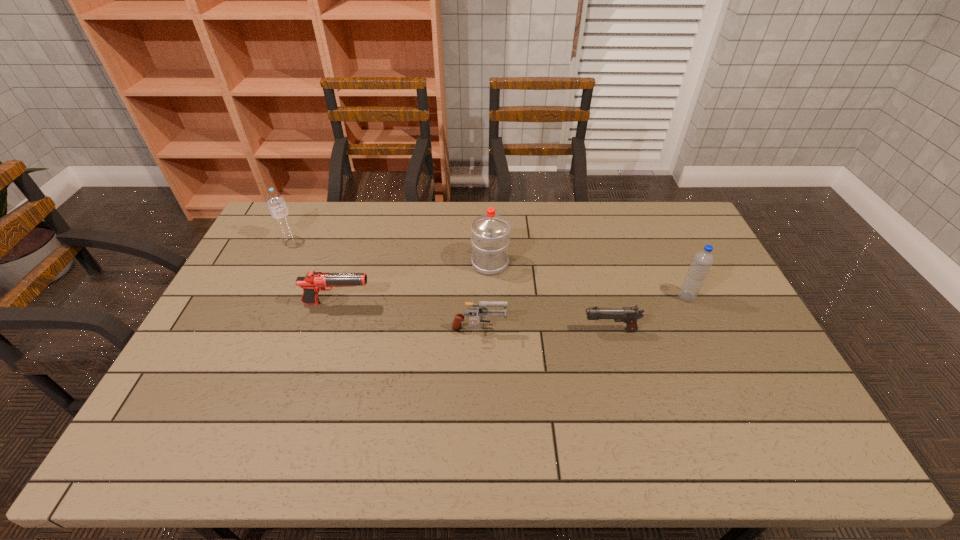
Locate an element on the screen. Image resolution: width=960 pixels, height=540 pixels. vacant space located on the handle side of the second water bottle from left to right is located at coordinates (489, 217).

Where is `vacant space located 0.080m on the handle side of the second water bottle from left to right`? vacant space located 0.080m on the handle side of the second water bottle from left to right is located at coordinates (490, 237).

You are a GUI agent. You are given a task and a screenshot of the screen. Output one action in this format:
    pyautogui.click(x=<x>, y=<y>)
    Task: Click on the vacant region located 0.110m on the handle side of the second water bottle from left to right
    
    Given the screenshot: What is the action you would take?
    pyautogui.click(x=490, y=232)

Identify the location of vacant area situated on the right of the leftmost object. Image resolution: width=960 pixels, height=540 pixels. (334, 240).

You are a GUI agent. You are given a task and a screenshot of the screen. Output one action in this format:
    pyautogui.click(x=<x>, y=<y>)
    Task: Click on the free location located on the front of the rightmost object
    This screenshot has width=960, height=540.
    Given the screenshot: What is the action you would take?
    click(700, 326)

What are the coordinates of `free region located at the aiming end of the leftmost gun` in the screenshot? It's located at (433, 303).

Find the location of a particular element. This screenshot has height=540, width=960. free space located at the barrel end of the second gun from right to left is located at coordinates (540, 332).

The image size is (960, 540). Identify the location of vacant space located in the direction the rightmost gun is aimed. (538, 330).

This screenshot has height=540, width=960. I want to click on blank space located 0.330m in the direction the rightmost gun is aimed, so click(468, 330).

The image size is (960, 540). In order to click on free space located in the direction the rightmost gun is aimed in this screenshot , I will do `click(492, 330)`.